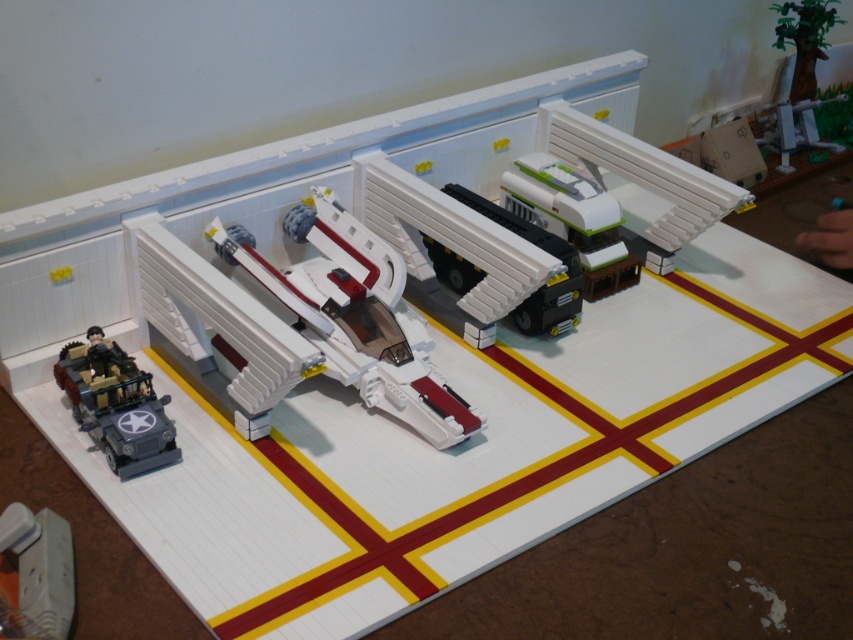
Question: Which of the following is the farthest from the observer?

Choices:
 (A) (70, 538)
 (B) (325, 284)

Answer: (B)

Question: Is matte gray military jeep at lower left wider than white plastic plug at lower left?

Choices:
 (A) no
 (B) yes

Answer: (B)

Question: From the image, what is the correct spatial relationship of white plastic truck at center in relation to matte gray military jeep at lower left?

Choices:
 (A) right
 (B) left

Answer: (A)

Question: Is matte gray military jeep at lower left to the right of white plastic plug at lower left from the viewer's perspective?

Choices:
 (A) yes
 (B) no

Answer: (A)

Question: Which object appears closest to the camera in this image?

Choices:
 (A) white plastic plug at lower left
 (B) matte gray military jeep at lower left
 (C) white plastic spaceship at center

Answer: (A)

Question: Which of the following is the farthest from the observer?

Choices:
 (A) matte gray military jeep at lower left
 (B) white plastic spaceship at center
 (C) white plastic plug at lower left
 (D) white plastic truck at center

Answer: (D)